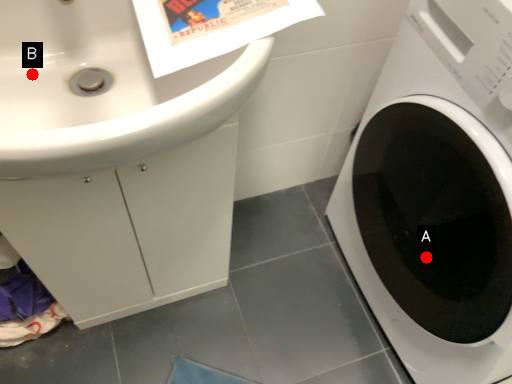
Question: Two points are circled on the image, labeled by A and B beside each circle. Which point is further to the camera?

Choices:
 (A) A is further
 (B) B is further

Answer: (A)